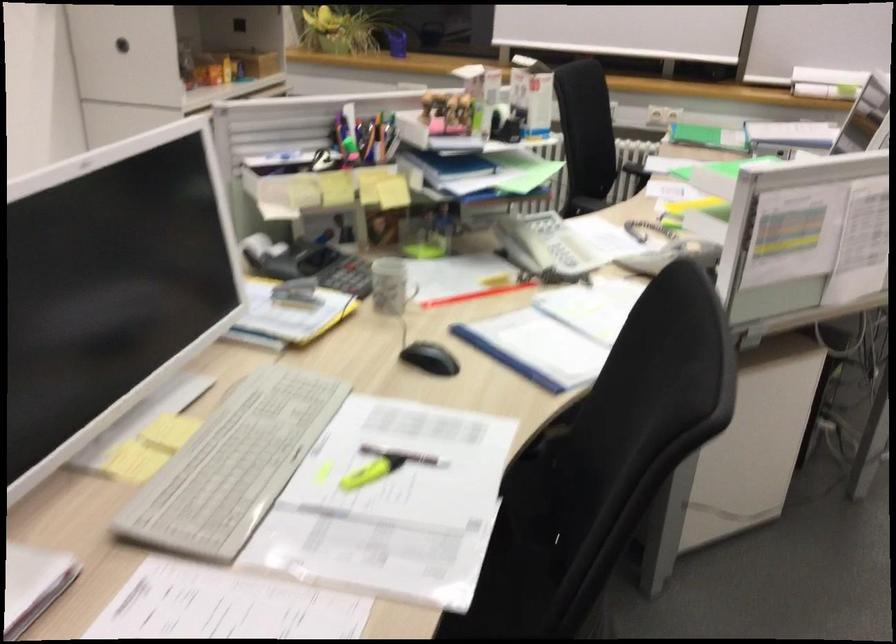
Identify the location of black chair sitting surface. (518, 554).